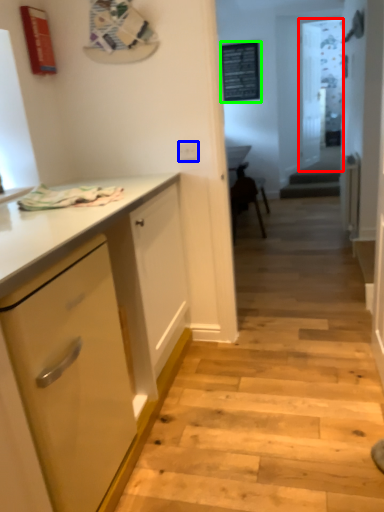
Question: Based on their relative distances, which object is nearer to glass door (highlighted by a red box)? Choose from electric outlet (highlighted by a blue box) and bulletin board (highlighted by a green box).

Choices:
 (A) electric outlet
 (B) bulletin board

Answer: (B)